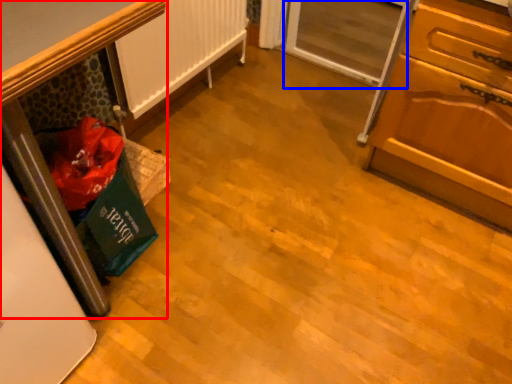
Question: Which object is closer to the camera taking this photo, furniture (highlighted by a red box) or screen door (highlighted by a blue box)?

Choices:
 (A) furniture
 (B) screen door

Answer: (A)